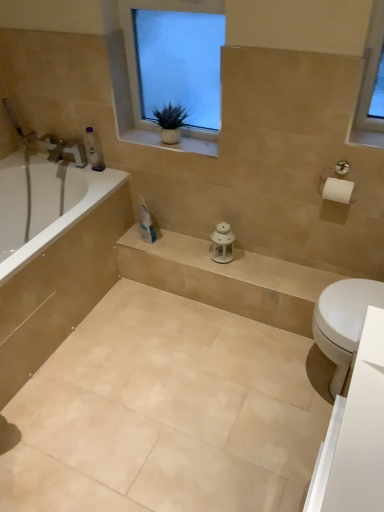
Question: Is translucent plastic bottle at upper left oriented away from beige stone balustrade at center?

Choices:
 (A) no
 (B) yes

Answer: (A)

Question: From a real-world perspective, is translucent plastic bottle at upper left positioned over beige stone balustrade at center based on gravity?

Choices:
 (A) no
 (B) yes

Answer: (B)

Question: From the image's perspective, is translucent plastic bottle at upper left located above beige stone balustrade at center?

Choices:
 (A) no
 (B) yes

Answer: (B)

Question: Can you confirm if translucent plastic bottle at upper left is positioned to the right of beige stone balustrade at center?

Choices:
 (A) yes
 (B) no

Answer: (B)

Question: Is there a large distance between translucent plastic bottle at upper left and beige stone balustrade at center?

Choices:
 (A) yes
 (B) no

Answer: (B)

Question: From the image's perspective, is translucent plastic bottle at upper left located above or below beige ceramic tile at lower center?

Choices:
 (A) above
 (B) below

Answer: (A)

Question: Is translucent plastic bottle at upper left spatially inside beige ceramic tile at lower center, or outside of it?

Choices:
 (A) outside
 (B) inside

Answer: (A)

Question: Is translucent plastic bottle at upper left bigger or smaller than beige ceramic tile at lower center?

Choices:
 (A) big
 (B) small

Answer: (B)

Question: Relative to beige ceramic tile at lower center, is translucent plastic bottle at upper left in front or behind?

Choices:
 (A) front
 (B) behind

Answer: (B)

Question: In terms of height, does beige stone balustrade at center look taller or shorter compared to beige ceramic tile at lower center?

Choices:
 (A) tall
 (B) short

Answer: (B)

Question: From a real-world perspective, relative to beige ceramic tile at lower center, is beige stone balustrade at center vertically above or below?

Choices:
 (A) above
 (B) below

Answer: (A)

Question: Considering the positions of beige stone balustrade at center and beige ceramic tile at lower center in the image, is beige stone balustrade at center wider or thinner than beige ceramic tile at lower center?

Choices:
 (A) thin
 (B) wide

Answer: (A)

Question: Is beige stone balustrade at center inside or outside of beige ceramic tile at lower center?

Choices:
 (A) inside
 (B) outside

Answer: (B)

Question: From a real-world perspective, relative to green matte plant at upper center, is white textured window at upper center vertically above or below?

Choices:
 (A) below
 (B) above

Answer: (B)

Question: Considering the relative positions of white textured window at upper center and green matte plant at upper center in the image provided, is white textured window at upper center to the left or to the right of green matte plant at upper center?

Choices:
 (A) right
 (B) left

Answer: (A)